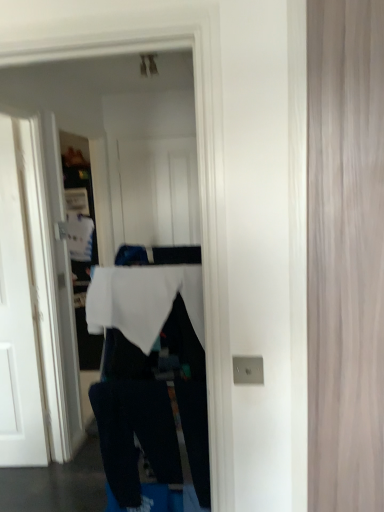
What do you see at coordinates (17, 326) in the screenshot? This screenshot has width=384, height=512. I see `white painted wood door at left` at bounding box center [17, 326].

You are a GUI agent. You are given a task and a screenshot of the screen. Output one action in this format:
    pyautogui.click(x=<x>, y=<y>)
    Task: Click on the white painted wood door at left
    Image resolution: width=384 pixels, height=512 pixels.
    Given the screenshot: What is the action you would take?
    pyautogui.click(x=17, y=326)

Between white painted wood door at left and white matte tablecloth at center, which one is positioned behind?

white painted wood door at left is more distant.

Based on the photo, is white painted wood door at left oriented towards white matte tablecloth at center?

No.

From the picture: Considering the relative positions of white painted wood door at left and white matte tablecloth at center in the image provided, is white painted wood door at left to the left or to the right of white matte tablecloth at center?

From the image, it's evident that white painted wood door at left is to the left of white matte tablecloth at center.

From the image's perspective, is white painted wood door at left over white matte tablecloth at center?

Incorrect, from the image's perspective, white painted wood door at left is lower than white matte tablecloth at center.

Does white matte tablecloth at center have a lesser width compared to white painted wood door at left?

Incorrect, the width of white matte tablecloth at center is not less than that of white painted wood door at left.

Does point (94, 305) come closer to viewer compared to point (0, 402)?

Yes, point (94, 305) is in front of point (0, 402).

Is white matte tablecloth at center outside of white painted wood door at left?

Yes.

From a real-world perspective, is white matte tablecloth at center above or below white painted wood door at left?

Clearly, from a real-world perspective, white matte tablecloth at center is above white painted wood door at left.

Are dark blue cotton trousers at lower center and wooden door at right located far from each other?

No, there isn't a large distance between dark blue cotton trousers at lower center and wooden door at right.

Find the location of a particular element. This screenshot has height=512, width=384. trousers lying on the left of wooden door at right is located at coordinates (136, 434).

In terms of height, does dark blue cotton trousers at lower center look taller or shorter compared to wooden door at right?

dark blue cotton trousers at lower center is shorter than wooden door at right.

Considering the sizes of objects dark blue cotton trousers at lower center and wooden door at right in the image provided, who is wider, dark blue cotton trousers at lower center or wooden door at right?

dark blue cotton trousers at lower center is wider.

Can you confirm if wooden door at right is smaller than white painted wood door at left?

Yes.

Considering the points (355, 275) and (19, 243), which point is in front, point (355, 275) or point (19, 243)?

The point (355, 275) is closer to the camera.

From the picture: From the image's perspective, which object appears higher, wooden door at right or white painted wood door at left?

wooden door at right, from the image's perspective.

Is wooden door at right not within white painted wood door at left?

Yes.

Which is closer to the camera, (14, 193) or (124, 490)?

Point (14, 193) is positioned farther from the camera compared to point (124, 490).

Can you confirm if white painted wood door at left is bigger than dark blue cotton trousers at lower center?

Correct, white painted wood door at left is larger in size than dark blue cotton trousers at lower center.

From the picture: Is white painted wood door at left to the left of dark blue cotton trousers at lower center from the viewer's perspective?

Yes, white painted wood door at left is to the left of dark blue cotton trousers at lower center.

Between white painted wood door at left and dark blue cotton trousers at lower center, which one has less height?

Standing shorter between the two is dark blue cotton trousers at lower center.

Looking at this image, which is closer, (110, 424) or (202, 455)?

Clearly, point (110, 424) is more distant from the camera than point (202, 455).

From the image's perspective, is dark blue cotton trousers at lower center beneath white fabric at center?

Yes, from the image's perspective, dark blue cotton trousers at lower center is beneath white fabric at center.

Who is taller, dark blue cotton trousers at lower center or white fabric at center?

Standing taller between the two is white fabric at center.

In the scene shown: From a real-world perspective, which object rests below the other?

dark blue cotton trousers at lower center.

Does wooden door at right turn towards dark blue cotton trousers at lower center?

No, wooden door at right is not oriented towards dark blue cotton trousers at lower center.

Considering the sizes of wooden door at right and dark blue cotton trousers at lower center in the image, is wooden door at right taller or shorter than dark blue cotton trousers at lower center?

Considering their sizes, wooden door at right has more height than dark blue cotton trousers at lower center.

From the image's perspective, between wooden door at right and dark blue cotton trousers at lower center, which one is located above?

wooden door at right appears higher in the image.

Locate an element on the screen. This screenshot has width=384, height=512. door that is under the white matte tablecloth at center (from a real-world perspective) is located at coordinates (17, 326).

Image resolution: width=384 pixels, height=512 pixels. I want to click on tablecloth above the white painted wood door at left (from a real-world perspective), so click(143, 300).

When comparing their distances from wooden door at right, does dark blue cotton trousers at lower center or white fabric at center seem further?

dark blue cotton trousers at lower center is further to wooden door at right.

Based on their spatial positions, is dark blue cotton trousers at lower center or wooden door at right closer to white fabric at center?

dark blue cotton trousers at lower center.

From the picture: Looking at the image, which one is located further to white fabric at center, white matte tablecloth at center or white painted wood door at left?

white painted wood door at left.

From the image, which object appears to be nearer to dark blue cotton trousers at lower center, wooden door at right or white painted wood door at left?

wooden door at right.

Looking at this image, looking at the image, which one is located closer to white painted wood door at left, wooden door at right or white matte tablecloth at center?

Based on the image, white matte tablecloth at center appears to be nearer to white painted wood door at left.

Which object lies further to the anchor point white painted wood door at left, wooden door at right or white fabric at center?

The object further to white painted wood door at left is wooden door at right.

Considering their positions, is white painted wood door at left positioned further to dark blue cotton trousers at lower center than wooden door at right?

Based on the image, white painted wood door at left appears to be further to dark blue cotton trousers at lower center.

Estimate the real-world distances between objects in this image. Which object is further from dark blue cotton trousers at lower center, wooden door at right or white fabric at center?

Among the two, wooden door at right is located further to dark blue cotton trousers at lower center.

Where is `trousers between white painted wood door at left and white matte tablecloth at center in the horizontal direction`? The width and height of the screenshot is (384, 512). trousers between white painted wood door at left and white matte tablecloth at center in the horizontal direction is located at coordinates (136, 434).

Locate an element on the screen. The height and width of the screenshot is (512, 384). tablecloth between white painted wood door at left and white fabric at center in the horizontal direction is located at coordinates (143, 300).

I want to click on person between white matte tablecloth at center and wooden door at right, so click(x=150, y=373).

You are a GUI agent. You are given a task and a screenshot of the screen. Output one action in this format:
    pyautogui.click(x=<x>, y=<y>)
    Task: Click on the tablecloth located between dark blue cotton trousers at lower center and wooden door at right in the left-right direction
    Image resolution: width=384 pixels, height=512 pixels.
    Given the screenshot: What is the action you would take?
    pyautogui.click(x=143, y=300)